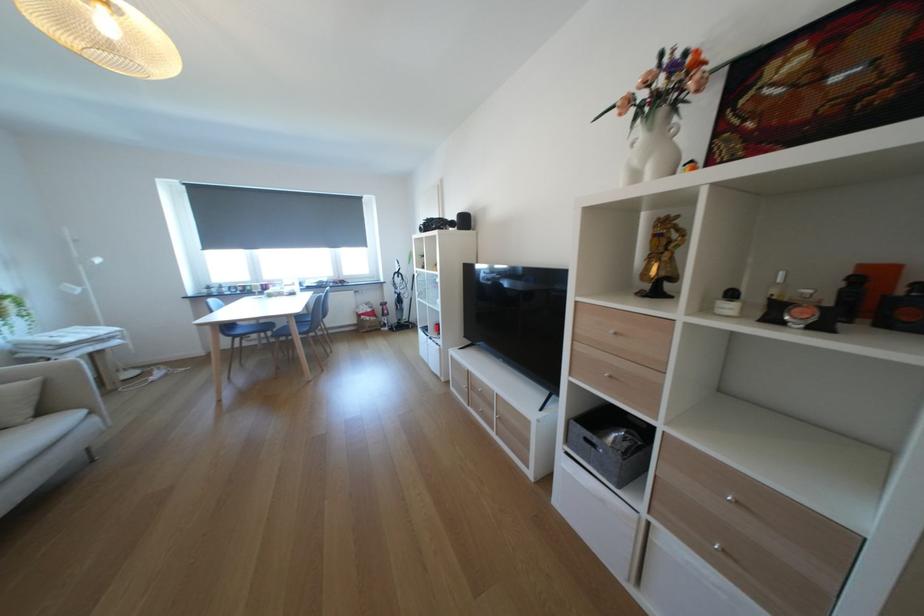
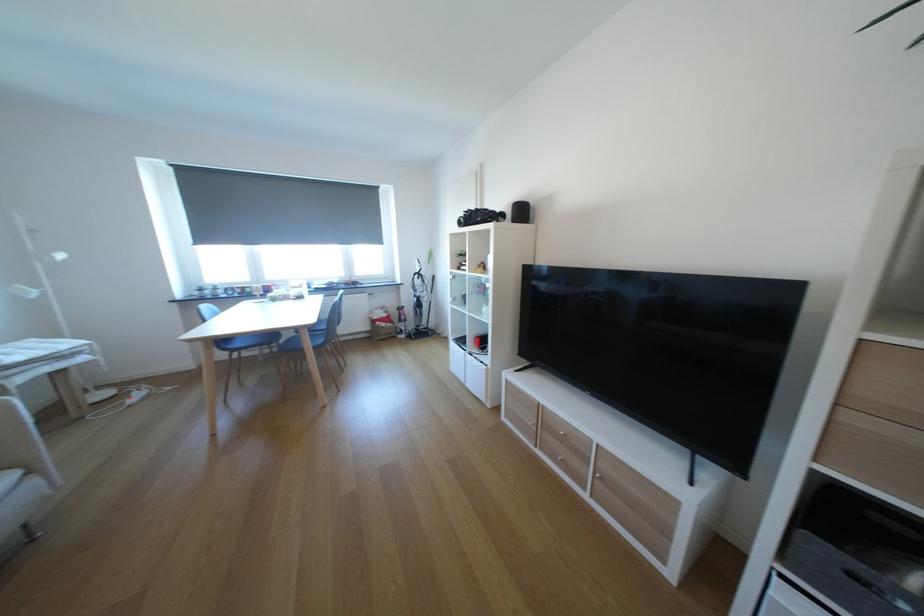
What movement of the cameraman would produce the second image?

The cameraman moved toward left, forward.